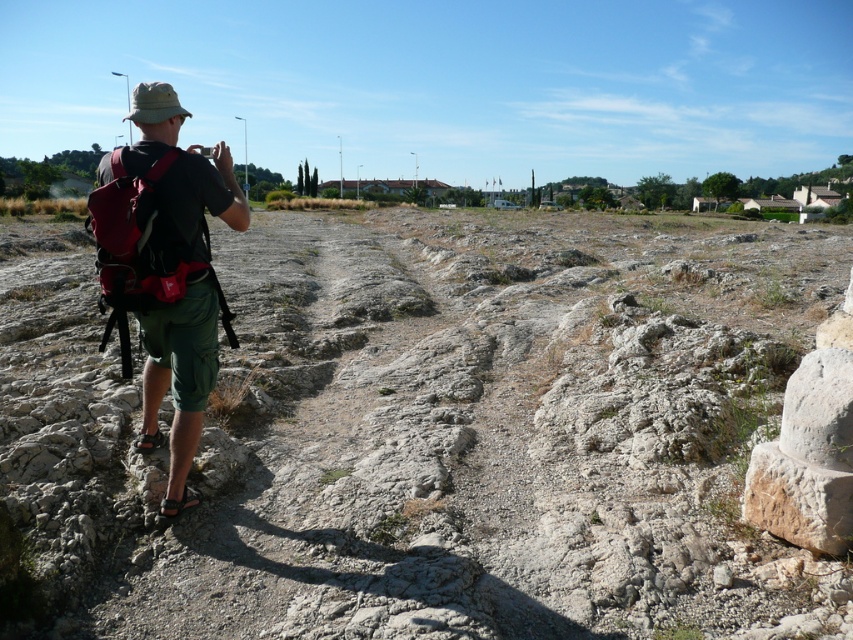
Does gray rocky terrain at center appear on the left side of green fabric shorts at left?

In fact, gray rocky terrain at center is to the right of green fabric shorts at left.

Is point (718, 378) positioned in front of point (140, 180)?

That is False.

Who is more forward, [30,556] or [115,236]?

Point [30,556] is in front.

At what (x,y) coordinates should I click in order to perform the action: click on gray rocky terrain at center. Please return your answer as a coordinate pair (x, y). This screenshot has width=853, height=640. Looking at the image, I should click on (430, 429).

Measure the distance between green fabric shorts at left and matte red backpack at left.

They are 7.33 inches apart.

Can you confirm if green fabric shorts at left is taller than matte red backpack at left?

Indeed, green fabric shorts at left has a greater height compared to matte red backpack at left.

Who is more distant from viewer, (144,330) or (172,282)?

Positioned behind is point (144,330).

This screenshot has width=853, height=640. Identify the location of green fabric shorts at left. (167, 268).

Describe the element at coordinates (430, 429) in the screenshot. I see `gray rocky terrain at center` at that location.

Does gray rocky terrain at center appear on the left side of matte red backpack at left?

In fact, gray rocky terrain at center is to the right of matte red backpack at left.

Describe the element at coordinates (430, 429) in the screenshot. I see `gray rocky terrain at center` at that location.

The image size is (853, 640). I want to click on gray rocky terrain at center, so click(x=430, y=429).